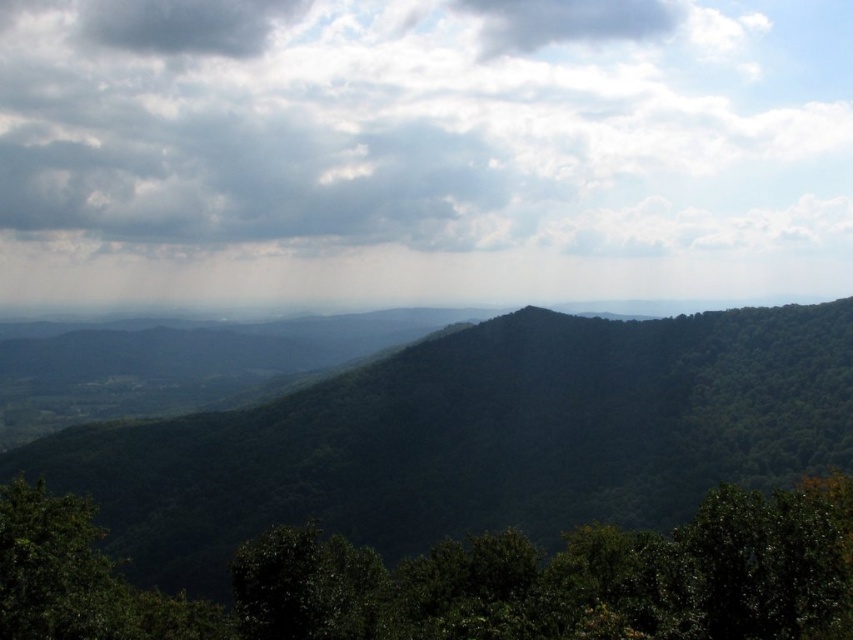
You are an environmental scientist analyzing the image. You need to compare the size of the cloudy sky at upper center and the green leafy tree at lower center. Which one appears bigger in the image?

The cloudy sky at upper center is larger in size than the green leafy tree at lower center, so the cloudy sky at upper center appears bigger in the image.

You are standing in the mountainous landscape and want to determine the relative positions of two points marked in the image. Which point, point [550,573] or point [123,28], is closer to you?

Point [550,573] is closer to the viewer than point [123,28].

From the picture: You are standing in the forest and see the green leafy tree at lower center and the dark gray cloud at upper left. Which object is closer to you?

The green leafy tree at lower center is closer to you because it is shorter than the dark gray cloud at upper left.